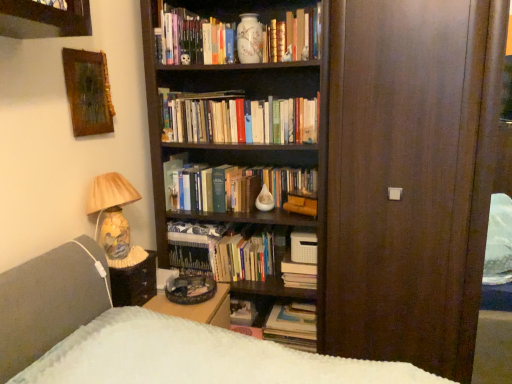
You are a GUI agent. You are given a task and a screenshot of the screen. Output one action in this format:
    pyautogui.click(x=<x>, y=<y>)
    Task: Click on the vacant space in matte ceramic lamp at left (from a real-world perspective)
    Image resolution: width=512 pixels, height=384 pixels.
    Given the screenshot: What is the action you would take?
    pyautogui.click(x=124, y=256)